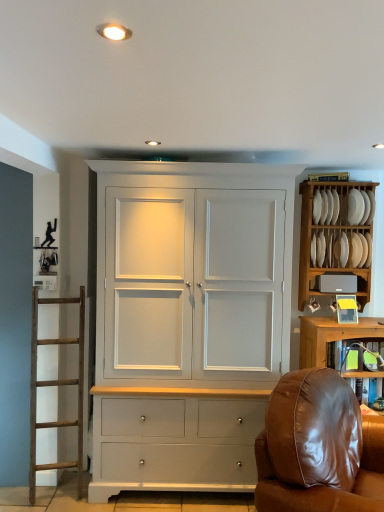
Question: Is brown leather chair at lower right to the right of white wood plate rack at upper right from the viewer's perspective?

Choices:
 (A) no
 (B) yes

Answer: (A)

Question: Is brown leather chair at lower right not near white wood plate rack at upper right?

Choices:
 (A) yes
 (B) no

Answer: (A)

Question: Is brown leather chair at lower right thinner than white wood plate rack at upper right?

Choices:
 (A) no
 (B) yes

Answer: (A)

Question: Can you confirm if brown leather chair at lower right is smaller than white wood plate rack at upper right?

Choices:
 (A) no
 (B) yes

Answer: (A)

Question: Could you tell me if brown leather chair at lower right is turned towards white wood plate rack at upper right?

Choices:
 (A) yes
 (B) no

Answer: (B)

Question: From a real-world perspective, relative to matte gray speaker at upper right, is brown leather chair at lower right vertically above or below?

Choices:
 (A) above
 (B) below

Answer: (B)

Question: From their relative heights in the image, would you say brown leather chair at lower right is taller or shorter than matte gray speaker at upper right?

Choices:
 (A) tall
 (B) short

Answer: (A)

Question: In terms of width, does brown leather chair at lower right look wider or thinner when compared to matte gray speaker at upper right?

Choices:
 (A) wide
 (B) thin

Answer: (A)

Question: Looking at the image, does brown leather chair at lower right seem bigger or smaller compared to matte gray speaker at upper right?

Choices:
 (A) small
 (B) big

Answer: (B)

Question: Does point (304, 291) appear closer or farther from the camera than point (350, 219)?

Choices:
 (A) farther
 (B) closer

Answer: (A)

Question: Is white wood plate rack at upper right situated inside white matte plate at upper right, the second plate in the left-to-right sequence, or outside?

Choices:
 (A) outside
 (B) inside

Answer: (A)

Question: Relative to white matte plate at upper right, the first plate viewed from the right, is white wood plate rack at upper right in front or behind?

Choices:
 (A) behind
 (B) front

Answer: (A)

Question: From the image's perspective, is white wood plate rack at upper right positioned above or below white matte plate at upper right, the first plate viewed from the right?

Choices:
 (A) below
 (B) above

Answer: (A)

Question: From a real-world perspective, is brown leather chair at lower right physically located above or below matte white light fixture at upper center?

Choices:
 (A) below
 (B) above

Answer: (A)

Question: Does point (360, 448) appear closer or farther from the camera than point (97, 29)?

Choices:
 (A) farther
 (B) closer

Answer: (A)